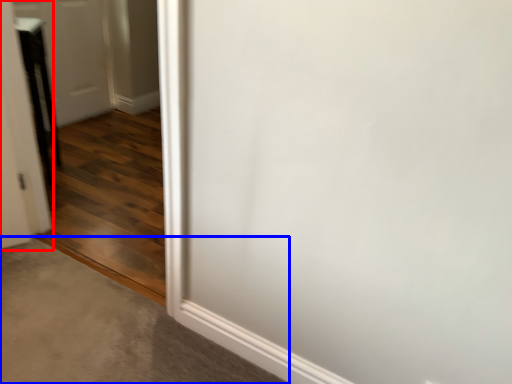
Question: Which object is closer to the camera taking this photo, door (highlighted by a red box) or concrete (highlighted by a blue box)?

Choices:
 (A) door
 (B) concrete

Answer: (B)